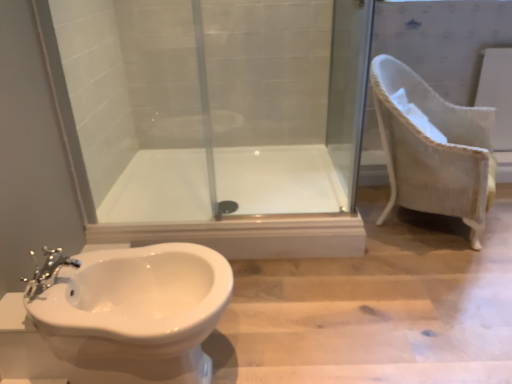
Question: Is white glossy bath at center smaller than white glossy toilet at lower left?

Choices:
 (A) yes
 (B) no

Answer: (B)

Question: Can you confirm if white glossy bath at center is positioned to the left of white glossy toilet at lower left?

Choices:
 (A) no
 (B) yes

Answer: (A)

Question: Is white glossy bath at center positioned with its back to white glossy toilet at lower left?

Choices:
 (A) no
 (B) yes

Answer: (A)

Question: Is white glossy toilet at lower left a part of white glossy bath at center?

Choices:
 (A) yes
 (B) no

Answer: (B)

Question: From the image's perspective, is white glossy bath at center below white glossy toilet at lower left?

Choices:
 (A) yes
 (B) no

Answer: (B)

Question: In terms of height, does transparent glass screen door at center look taller or shorter compared to white glossy toilet at lower left?

Choices:
 (A) tall
 (B) short

Answer: (A)

Question: Considering the positions of point (339, 74) and point (197, 337), is point (339, 74) closer or farther from the camera than point (197, 337)?

Choices:
 (A) closer
 (B) farther

Answer: (B)

Question: Considering the relative positions of transparent glass screen door at center and white glossy toilet at lower left in the image provided, is transparent glass screen door at center to the left or to the right of white glossy toilet at lower left?

Choices:
 (A) right
 (B) left

Answer: (A)

Question: Looking at the image, does transparent glass screen door at center seem bigger or smaller compared to white glossy toilet at lower left?

Choices:
 (A) big
 (B) small

Answer: (B)

Question: Looking at their shapes, would you say white woven armchair at right is wider or thinner than white glossy bath at center?

Choices:
 (A) wide
 (B) thin

Answer: (B)

Question: From a real-world perspective, is white woven armchair at right above or below white glossy bath at center?

Choices:
 (A) above
 (B) below

Answer: (A)

Question: Does point (460, 167) appear closer or farther from the camera than point (285, 188)?

Choices:
 (A) closer
 (B) farther

Answer: (A)

Question: From the image's perspective, is white woven armchair at right located above or below white glossy bath at center?

Choices:
 (A) below
 (B) above

Answer: (B)

Question: From the image's perspective, is white woven armchair at right positioned above or below white glossy toilet at lower left?

Choices:
 (A) above
 (B) below

Answer: (A)

Question: From a real-world perspective, is white woven armchair at right positioned above or below white glossy toilet at lower left?

Choices:
 (A) above
 (B) below

Answer: (A)